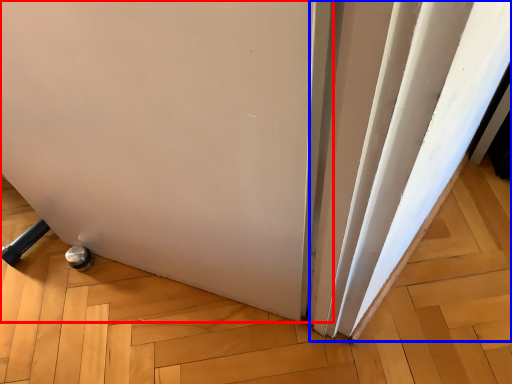
Question: Which object is further to the camera taking this photo, door (highlighted by a red box) or curtain (highlighted by a blue box)?

Choices:
 (A) door
 (B) curtain

Answer: (B)